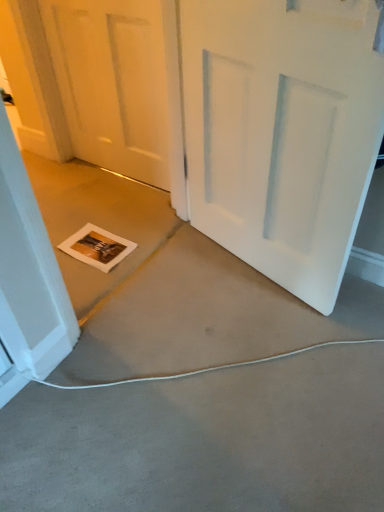
Question: Relative to white matte door at center, which is the 1th door in left-to-right order, is white matte door at center, the second door positioned from the left, in front or behind?

Choices:
 (A) behind
 (B) front

Answer: (B)

Question: Considering the positions of point (248, 200) and point (119, 93), is point (248, 200) closer or farther from the camera than point (119, 93)?

Choices:
 (A) farther
 (B) closer

Answer: (B)

Question: Which is farther from the white matte door at center, acting as the 2th door starting from the right?

Choices:
 (A) gray carpet at lower center
 (B) white matte door at center, which ranks as the 1th door in right-to-left order

Answer: (A)

Question: Which of these objects is positioned farthest from the white matte door at center, which ranks as the 1th door in right-to-left order?

Choices:
 (A) white matte door at center, which is the 1th door in left-to-right order
 (B) gray carpet at lower center

Answer: (A)